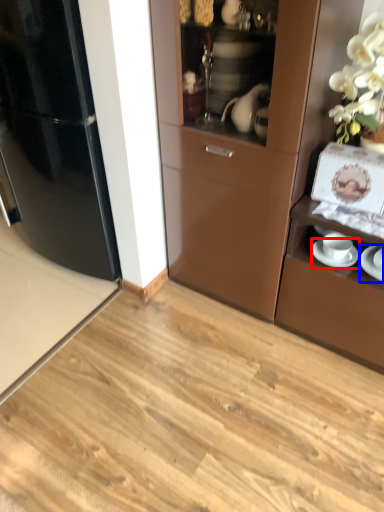
Question: Which object appears farthest to the camera in this image, saucer (highlighted by a red box) or saucer (highlighted by a blue box)?

Choices:
 (A) saucer
 (B) saucer

Answer: (A)